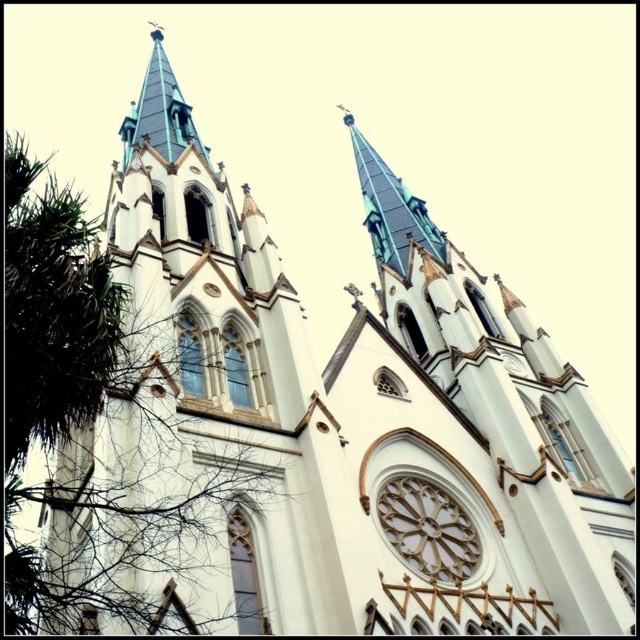
Can you confirm if white stone tower at center is positioned above green leafy tree at left?

Incorrect, white stone tower at center is not positioned above green leafy tree at left.

Can you confirm if white stone tower at center is smaller than green leafy tree at left?

Correct, white stone tower at center occupies less space than green leafy tree at left.

Locate an element on the screen. This screenshot has height=640, width=640. white stone tower at center is located at coordinates (492, 435).

Find the location of `white stone tower at center`. white stone tower at center is located at coordinates (492, 435).